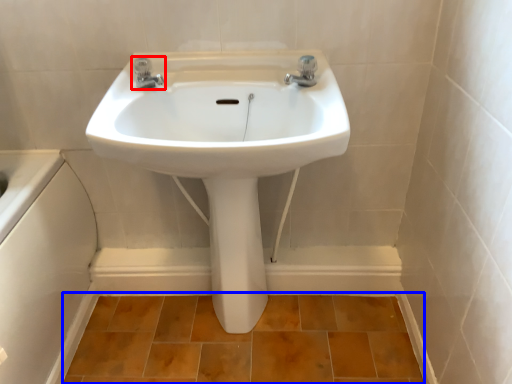
Question: Which point is closer to the camera, tap (highlighted by a red box) or ceramic tile (highlighted by a blue box)?

Choices:
 (A) tap
 (B) ceramic tile

Answer: (A)